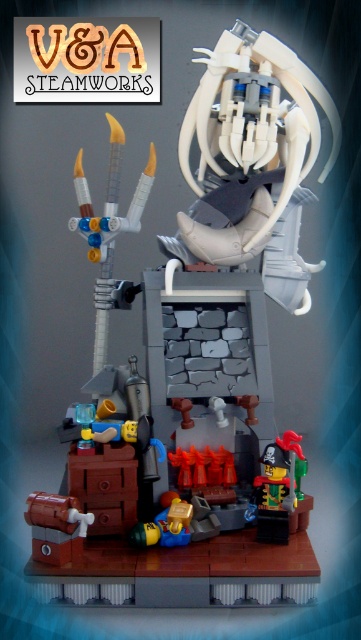
Is white matte/porcelain head at upper center bigger than translucent white plastic staff at left?

Yes.

Is white matte/porcelain head at upper center closer to the viewer compared to translucent white plastic staff at left?

That is True.

Where is `white matte/porcelain head at upper center`? This screenshot has width=361, height=640. white matte/porcelain head at upper center is located at coordinates 253,161.